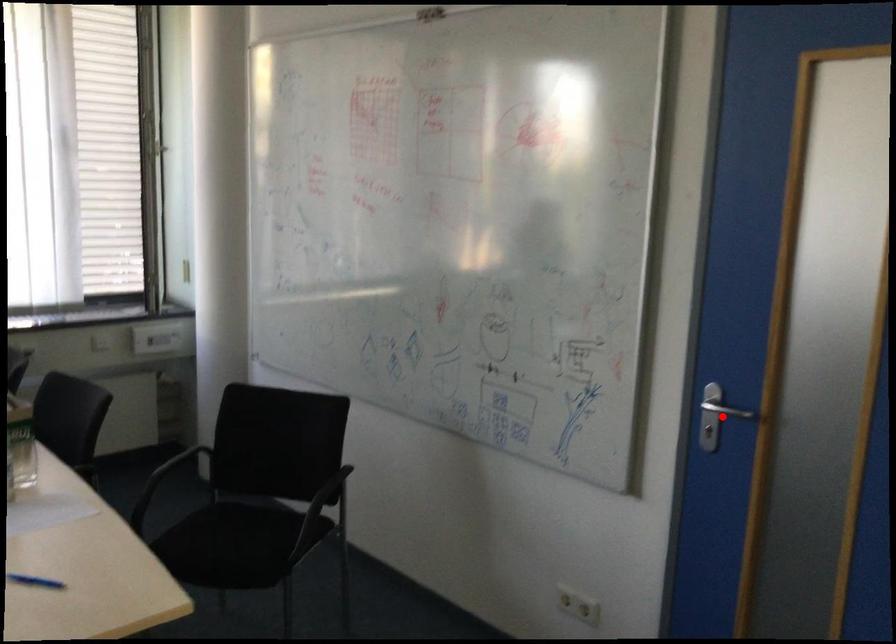
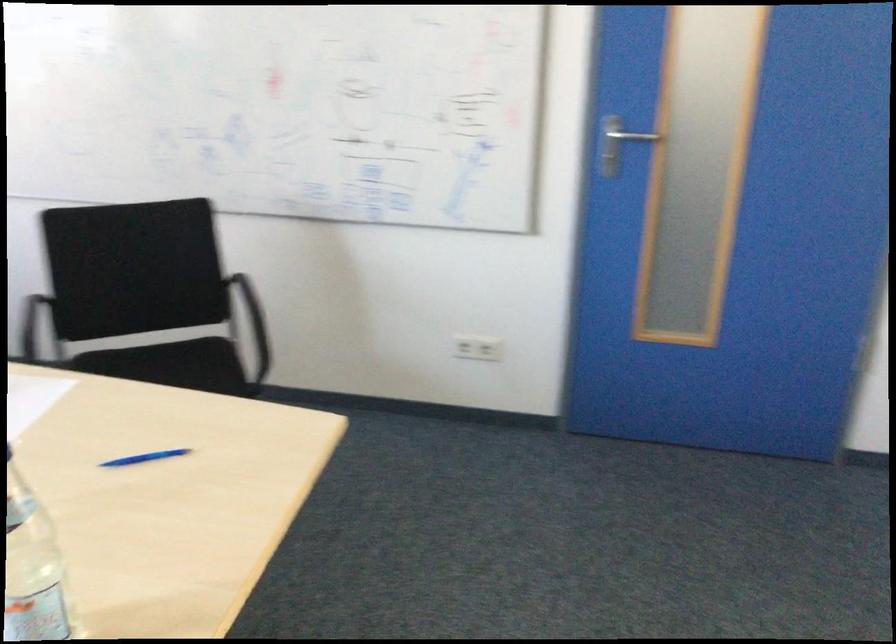
Where in the second image is the point corresponding to the highlighted location from the first image?

(616, 144)